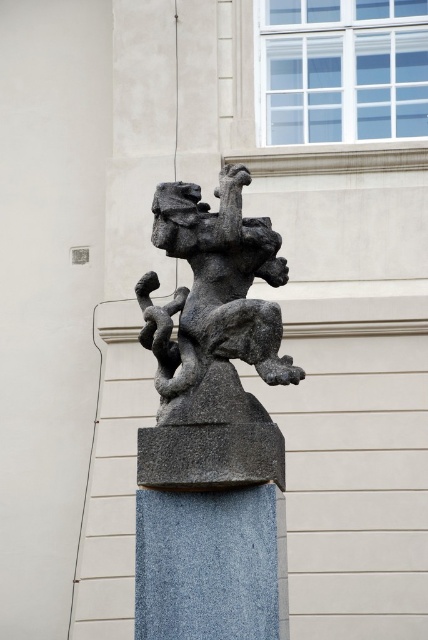
Question: Which point is farther to the camera?

Choices:
 (A) (253, 545)
 (B) (237, 332)

Answer: (B)

Question: Which object appears farthest from the camera in this image?

Choices:
 (A) gray stone pillar at center
 (B) granite statue at center

Answer: (B)

Question: Is granite statue at center thinner than gray stone pillar at center?

Choices:
 (A) yes
 (B) no

Answer: (B)

Question: Does granite statue at center appear under gray stone pillar at center?

Choices:
 (A) no
 (B) yes

Answer: (A)

Question: Observing the image, what is the correct spatial positioning of granite statue at center in reference to gray stone pillar at center?

Choices:
 (A) above
 (B) below

Answer: (A)